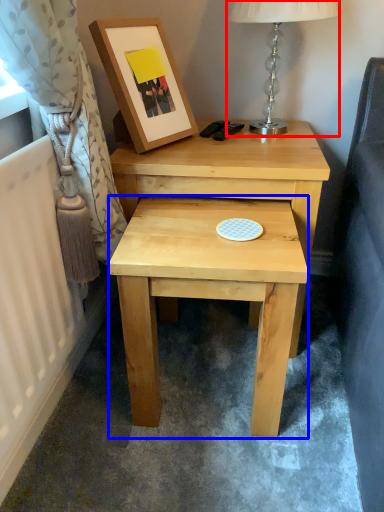
Question: Which of the following is the closest to the observer, table lamp (highlighted by a red box) or stool (highlighted by a blue box)?

Choices:
 (A) table lamp
 (B) stool

Answer: (B)